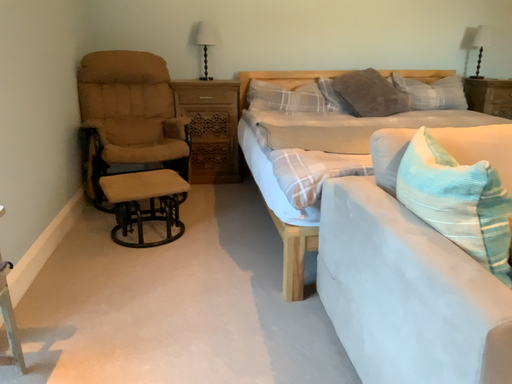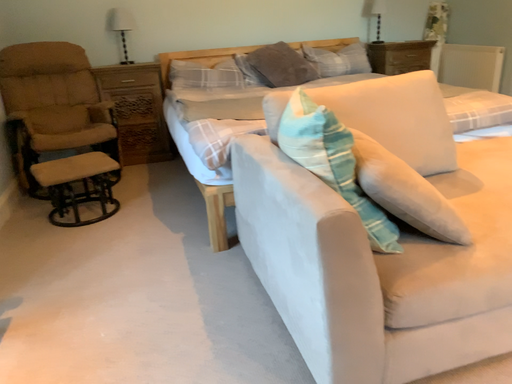
Question: Which way did the camera rotate in the video?

Choices:
 (A) rotated left
 (B) rotated right

Answer: (B)